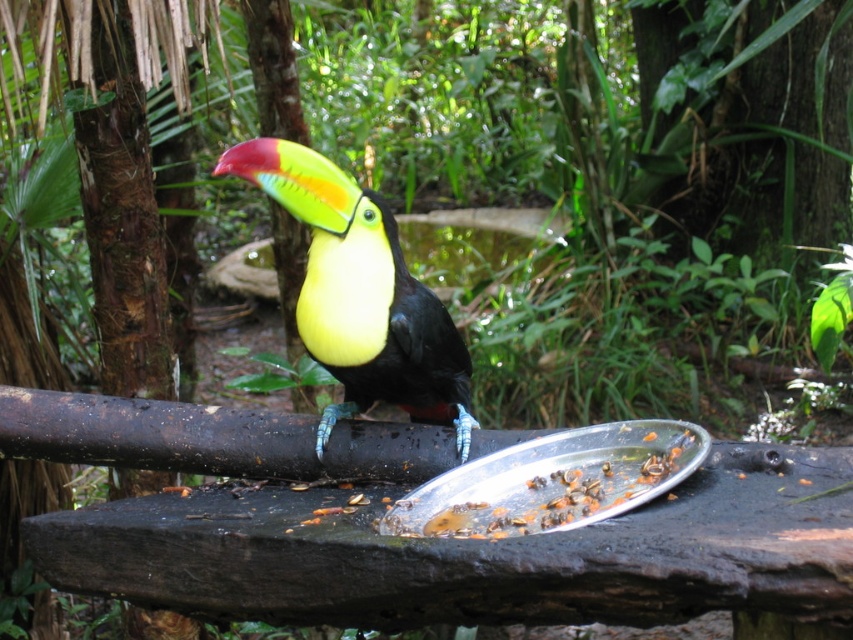
Who is more forward, (380, 259) or (660, 483)?

Positioned in front is point (660, 483).

Is point (326, 413) closer to viewer compared to point (677, 435)?

That is False.

At what (x,y) coordinates should I click in order to perform the action: click on shiny multicolored toucan at center. Please return your answer as a coordinate pair (x, y). This screenshot has height=640, width=853. Looking at the image, I should click on (361, 294).